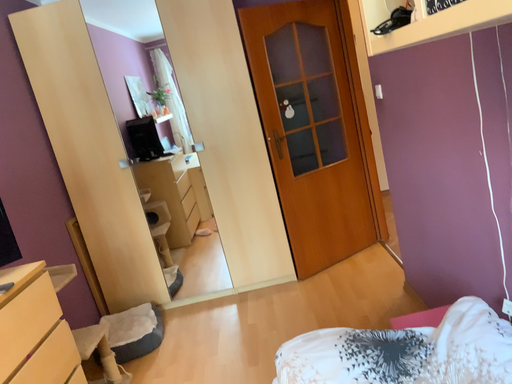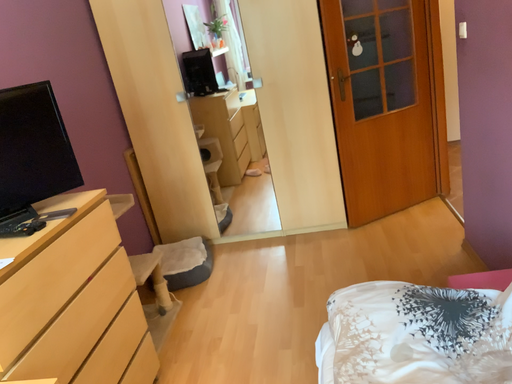
Question: Which way did the camera rotate in the video?

Choices:
 (A) rotated downward
 (B) rotated upward

Answer: (A)